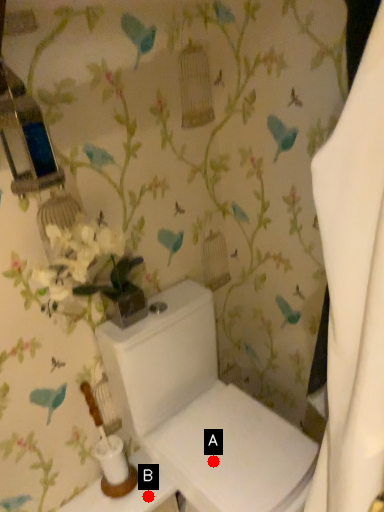
Question: Two points are circled on the image, labeled by A and B beside each circle. Among these points, which one is farthest from the camera?

Choices:
 (A) A is further
 (B) B is further

Answer: (B)